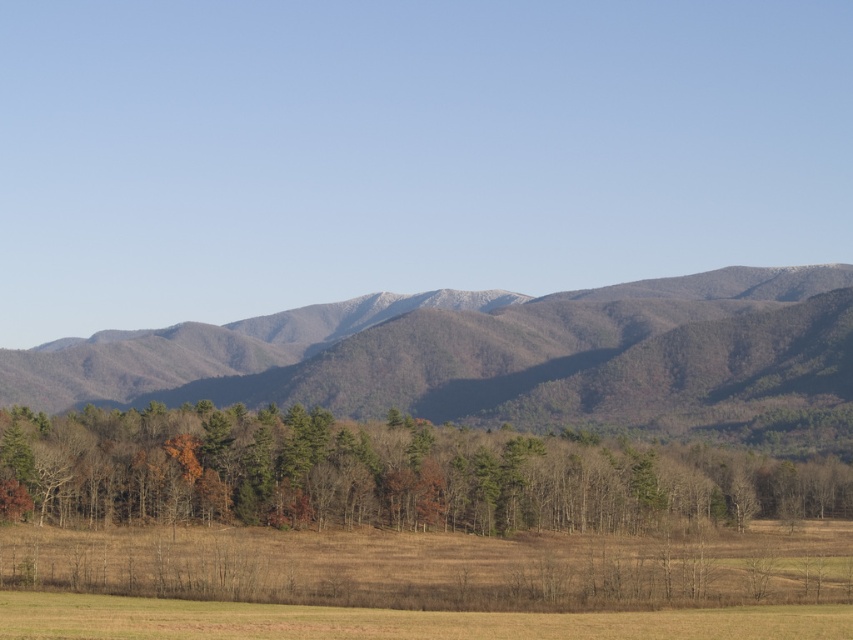
You are standing in the open field with dry grass in the foreground of the landscape. You notice two points marked in the scene. The first point is at coordinate point (572, 515) and the second at point (846, 614). Which point is closer to you?

Point (572, 515) is closer to you because it is further to the viewer than point (846, 614).

You are standing in the open field and want to walk towards the mountains. Which object will you encounter first, the brown textured trees at center or the brown grassland at lower center?

You will encounter the brown grassland at lower center first because it is closer to you than the brown textured trees at center, which are positioned behind it.

You are standing in the open field with dry grass in the foreground of the image. You see a point marked at coordinates (508, 358). What does this point indicate?

The point at coordinates (508, 358) marks the gray textured mountain range at center.